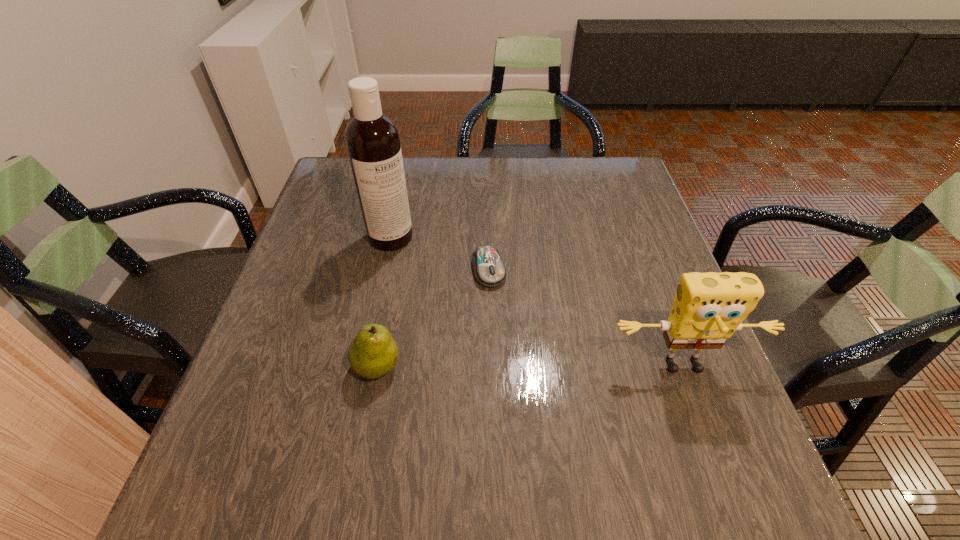
I want to click on vacant space that's between the rightmost object and the second shortest object, so click(x=531, y=367).

Identify the location of free space between the third tallest object and the sponge. 531,367.

Locate which object is the third closest to the second shortest object. Please provide its 2D coordinates. Your answer should be formatted as a tuple, i.e. [(x, y)], where the tuple contains the x and y coordinates of a point satisfying the conditions above.

[(709, 307)]

Choose which object is the third nearest neighbor to the sponge. Please provide its 2D coordinates. Your answer should be formatted as a tuple, i.e. [(x, y)], where the tuple contains the x and y coordinates of a point satisfying the conditions above.

[(372, 139)]

Image resolution: width=960 pixels, height=540 pixels. What are the coordinates of `vacant space that satisfies the following two spatial constraints: 1. on the front side of the second shortest object; 2. on the right side of the farthest object` in the screenshot? It's located at (363, 366).